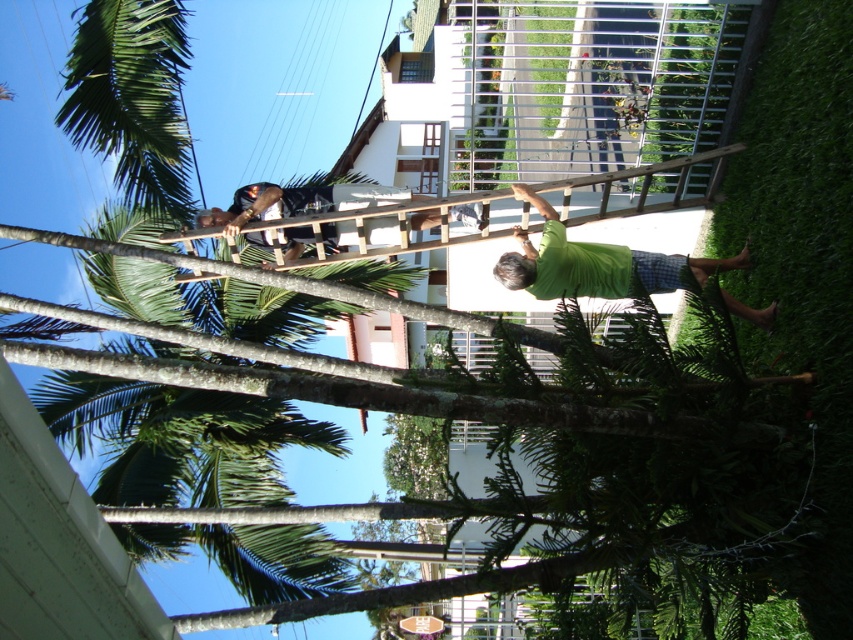
You are a delivery person trying to navigate through a residential area with a cart that has a 1.5m turning radius. You need to pass between the palm trees and the ladder setup to reach the front door. Based on the coordinates provided, can your cart maneuver around the point at (593, 262) without hitting anything?

The point at (593, 262) is located on the green matte shirt at lower right, which belongs to the person holding the ladder. Since the cart requires a 1.5m turning radius, it would need sufficient space around the person to maneuver safely. However, without knowing the exact dimensions of the area between the palm trees and the ladder setup, it is difficult to determine if the cart can navigate around the point without obstruction.

You are a pedestrian passing by the scene. You notice the green matte shirt at lower right and the wooden ladder at upper center. Which object is closer to the ground?

The green matte shirt at lower right is closer to the ground because it is positioned under the wooden ladder at upper center.